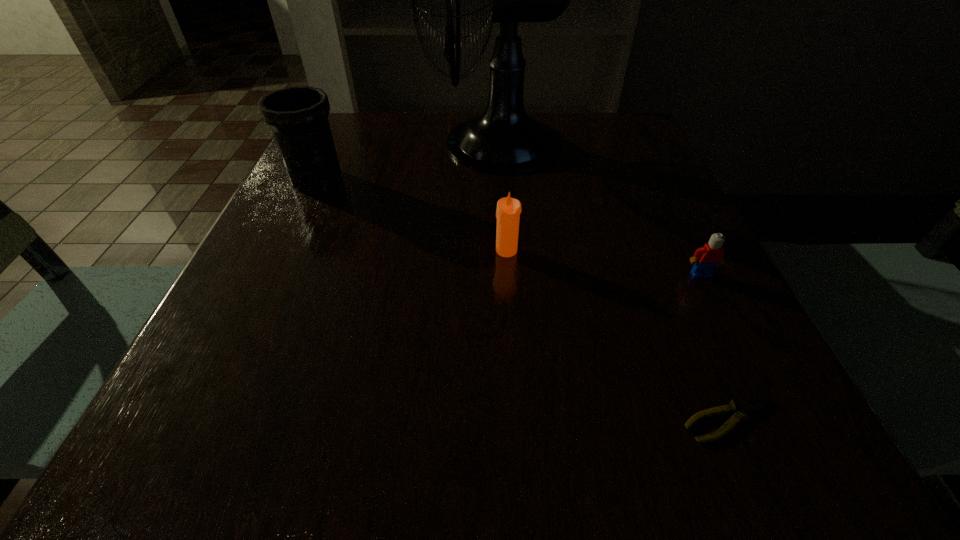
Find the location of a particular element. free space in the image that satisfies the following two spatial constraints: 1. on the back side of the candle; 2. on the front-facing side of the fan is located at coordinates (500, 144).

Where is `vacant space that satisfies the following two spatial constraints: 1. on the front-facing side of the nearest object; 2. on the left side of the tallest object`? vacant space that satisfies the following two spatial constraints: 1. on the front-facing side of the nearest object; 2. on the left side of the tallest object is located at coordinates (507, 420).

Find the location of a particular element. Image resolution: width=960 pixels, height=540 pixels. free location that satisfies the following two spatial constraints: 1. on the back side of the candle; 2. on the front-facing side of the fan is located at coordinates (500, 144).

The image size is (960, 540). Find the location of `free location that satisfies the following two spatial constraints: 1. on the front side of the shortest object; 2. on the right side of the telephoto lens`. free location that satisfies the following two spatial constraints: 1. on the front side of the shortest object; 2. on the right side of the telephoto lens is located at coordinates (203, 420).